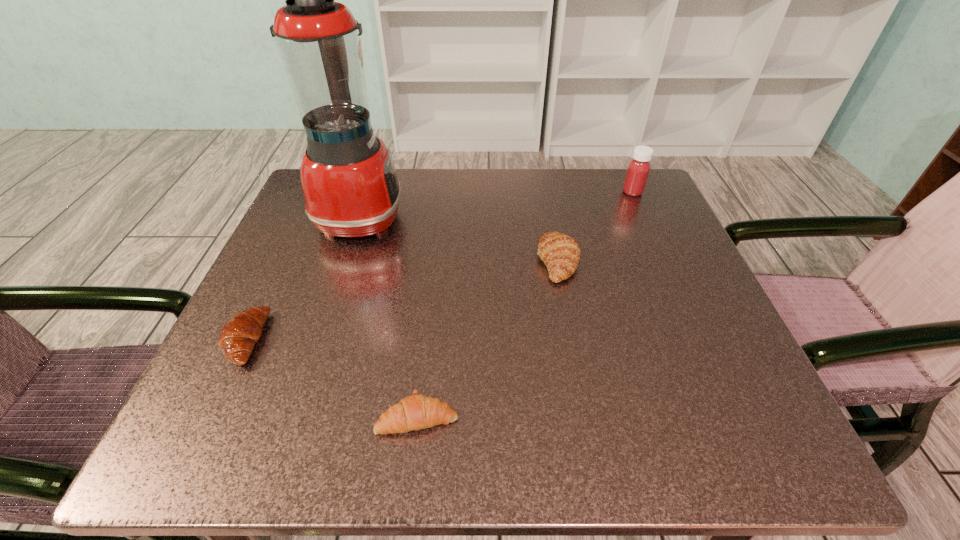
You are a GUI agent. You are given a task and a screenshot of the screen. Output one action in this format:
    pyautogui.click(x=<x>, y=<y>)
    Task: Click on the object present at the far left corner
    
    Given the screenshot: What is the action you would take?
    pyautogui.click(x=349, y=182)

The height and width of the screenshot is (540, 960). What are the coordinates of `object located in the far right corner section of the desktop` in the screenshot? It's located at (638, 169).

The image size is (960, 540). Identify the location of vacant space at the far edge of the desktop. (413, 218).

The height and width of the screenshot is (540, 960). I want to click on vacant area at the near edge of the desktop, so click(x=584, y=443).

This screenshot has height=540, width=960. In order to click on vacant space at the left edge of the desktop in this screenshot , I will do `click(297, 338)`.

You are a GUI agent. You are given a task and a screenshot of the screen. Output one action in this format:
    pyautogui.click(x=<x>, y=<y>)
    Task: Click on the free space at the right edge of the desktop
    The height and width of the screenshot is (540, 960).
    Given the screenshot: What is the action you would take?
    pyautogui.click(x=651, y=376)

This screenshot has height=540, width=960. What are the coordinates of `free space at the near left corner of the desktop` in the screenshot? It's located at (297, 427).

Find the location of `vacant region at the far right corner of the desktop`. vacant region at the far right corner of the desktop is located at coordinates (645, 198).

At what (x,y) coordinates should I click in order to perform the action: click on vacant space that's between the second farthest crescent roll and the rightmost object. Please return your answer as a coordinate pair (x, y). This screenshot has height=540, width=960. Looking at the image, I should click on (439, 266).

The image size is (960, 540). I want to click on free space between the second nearest object and the food processor, so click(x=303, y=278).